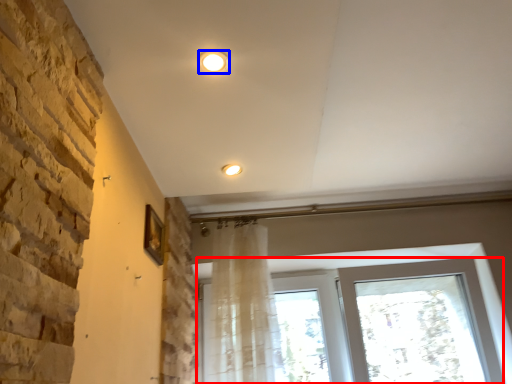
Question: Which point is closer to the camera, window (highlighted by a red box) or lighting (highlighted by a blue box)?

Choices:
 (A) window
 (B) lighting

Answer: (B)